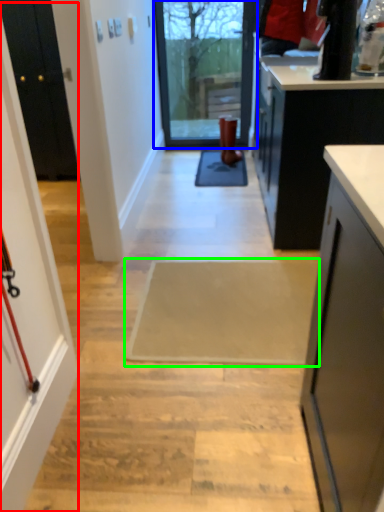
Question: Considering the real-world distances, which object is farthest from screen door (highlighted by a red box)? glass door (highlighted by a blue box) or doormat (highlighted by a green box)?

Choices:
 (A) glass door
 (B) doormat

Answer: (A)